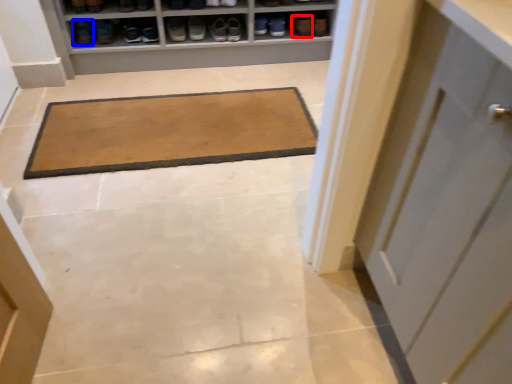
Question: Which object is closer to the camera taking this photo, shoe (highlighted by a red box) or footwear (highlighted by a blue box)?

Choices:
 (A) shoe
 (B) footwear

Answer: (B)